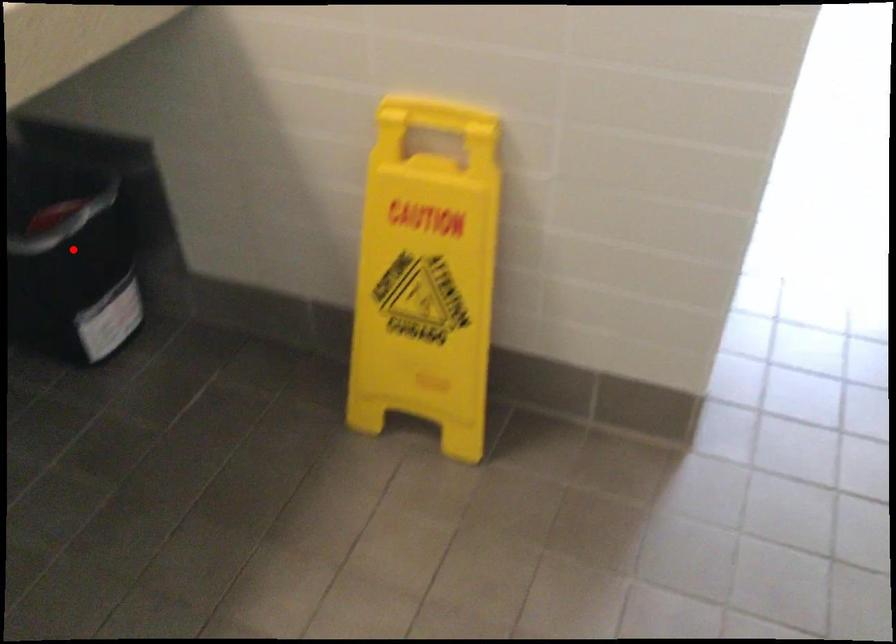
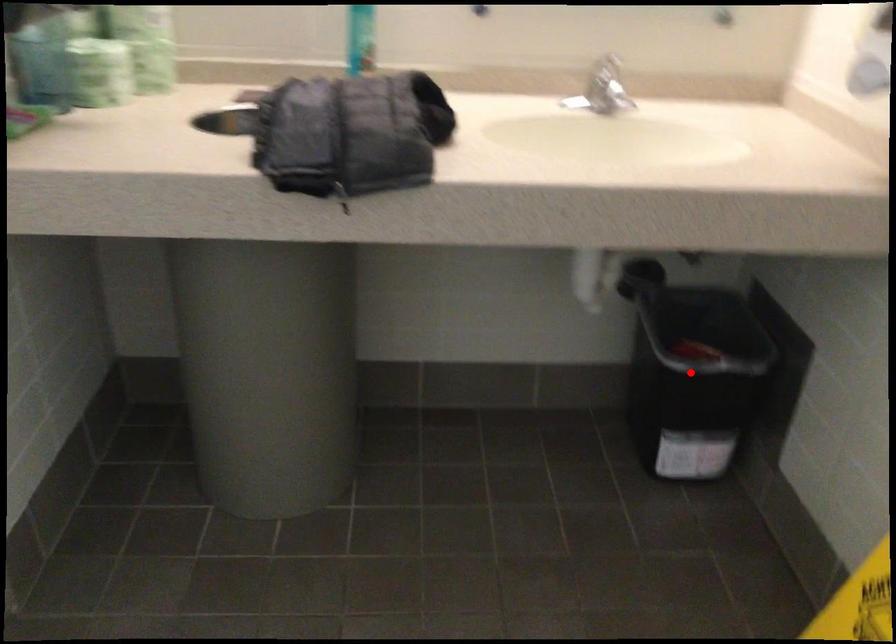
I am providing you with two images of the same scene from different viewpoints. A red point is marked on the first image and another point is marked on the second image. Is the red point in image1 aligned with the point shown in image2?

Yes